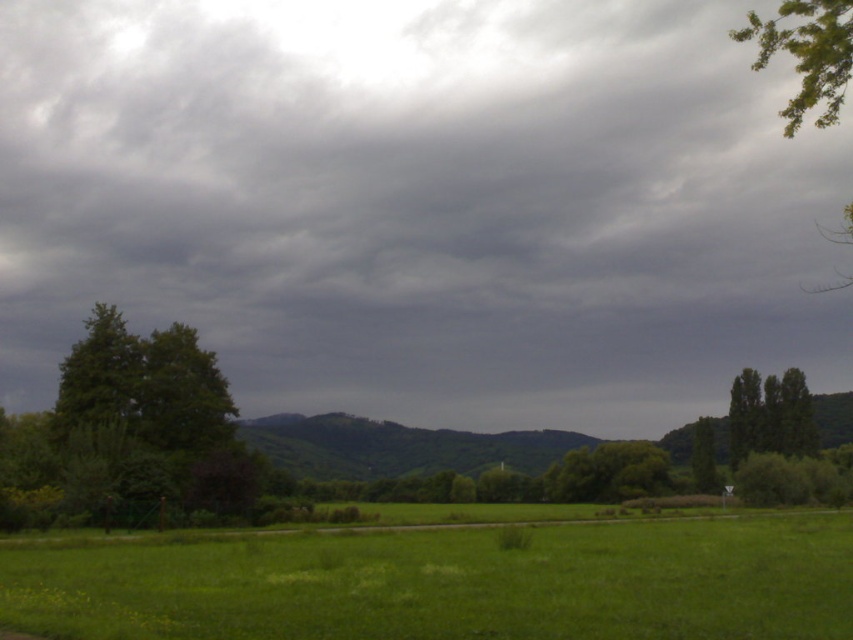
You are standing in the rural landscape and want to take a photo of both the green grass at lower center and the green leafy tree at upper right. Which object will appear larger in the photo?

A: The green leafy tree at upper right will appear larger in the photo because it occupies more space than the green grass at lower center.

You are a hiker planning to take a shortcut through the field. You notice two landmarks, the green leafy tree at left and the green leafy tree at upper right. Which tree would you use as a reference point if you want to avoid the taller tree?

The green leafy tree at left is shorter than the green leafy tree at upper right, so you should use the green leafy tree at left as your reference point to avoid the taller tree.